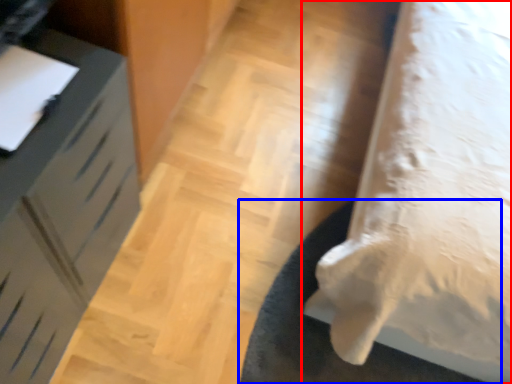
Question: Which object appears farthest to the camera in this image, furniture (highlighted by a red box) or mat (highlighted by a blue box)?

Choices:
 (A) furniture
 (B) mat

Answer: (B)